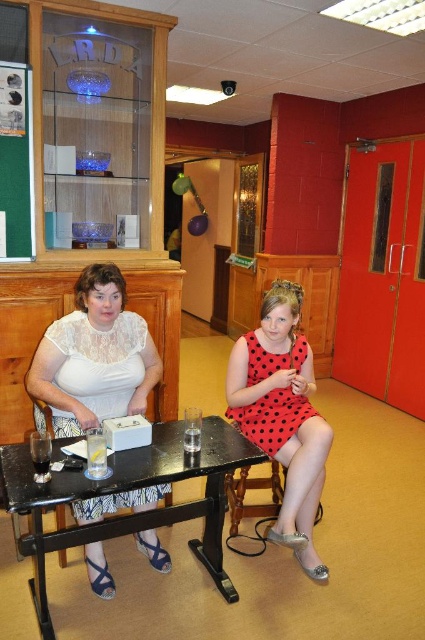
Question: Which object is farther from the camera taking this photo?

Choices:
 (A) red dotted dress at center
 (B) white lace dress at center
 (C) black wood table at center
 (D) green fabric bulletin board at left

Answer: (D)

Question: Among these points, which one is farthest from the camera?

Choices:
 (A) (280, 529)
 (B) (200, 552)
 (C) (14, 228)
 (D) (88, 392)

Answer: (C)

Question: Is white lace dress at center positioned in front of black wood table at center?

Choices:
 (A) yes
 (B) no

Answer: (B)

Question: Among these objects, which one is nearest to the camera?

Choices:
 (A) white lace dress at center
 (B) green fabric bulletin board at left
 (C) black wood table at center
 (D) red dotted dress at center

Answer: (C)

Question: From the image, what is the correct spatial relationship of black wood table at center in relation to green fabric bulletin board at left?

Choices:
 (A) below
 (B) above

Answer: (A)

Question: Is the position of black wood table at center less distant than that of red dotted dress at center?

Choices:
 (A) no
 (B) yes

Answer: (B)